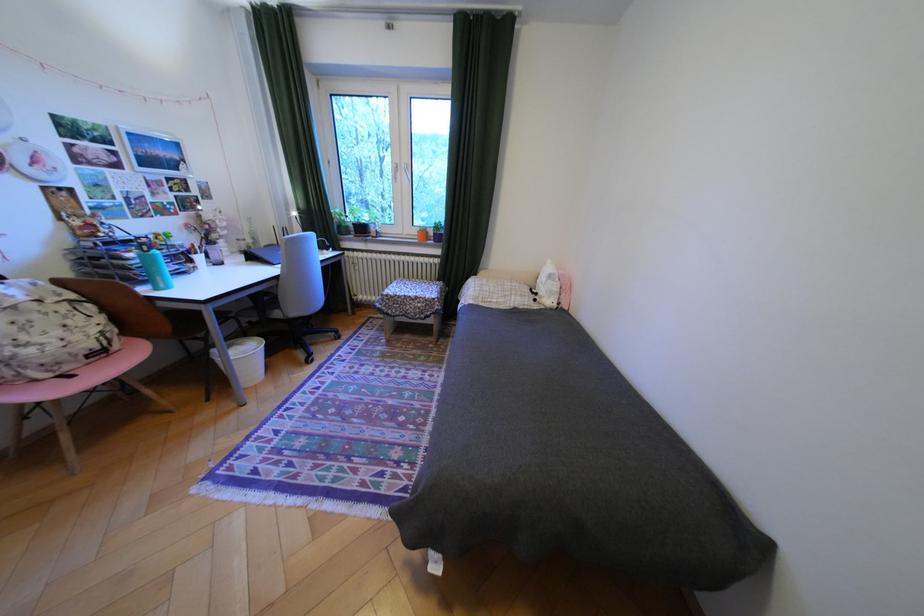
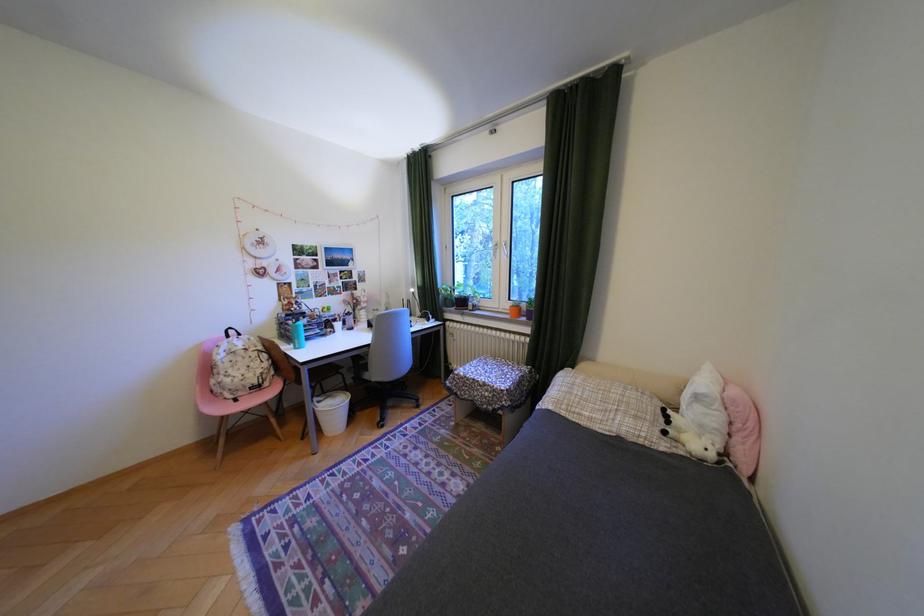
Locate, in the second image, the point that corresponds to point 562,282 in the first image.

(710, 408)